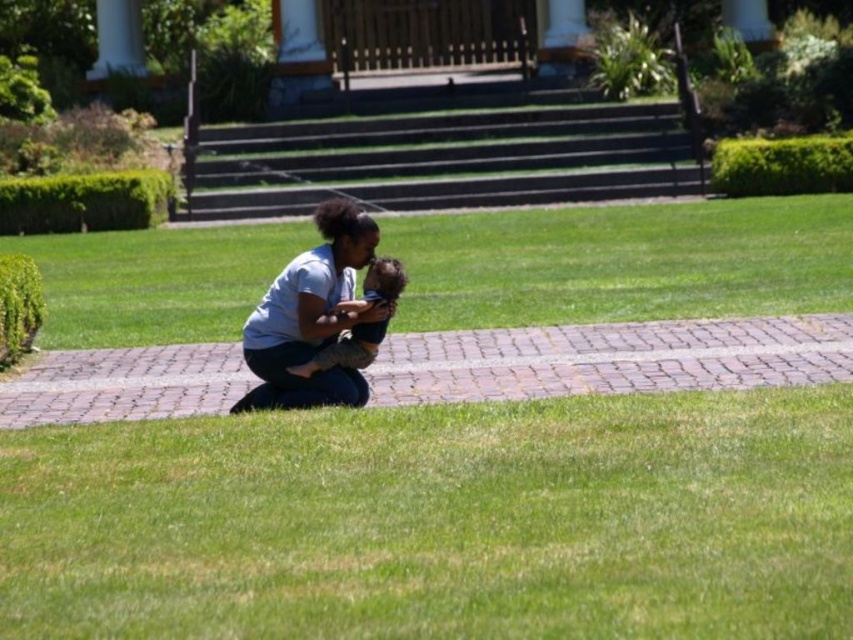
Question: Which object appears closest to the camera in this image?

Choices:
 (A) green grass at center
 (B) smooth skin child at center
 (C) light blue cotton shirt at center
 (D) green grass at lower center

Answer: (D)

Question: Does green grass at lower center have a lesser width compared to green grass at center?

Choices:
 (A) yes
 (B) no

Answer: (A)

Question: Which object appears closest to the camera in this image?

Choices:
 (A) light blue cotton shirt at center
 (B) green grass at center
 (C) smooth skin child at center

Answer: (A)

Question: Can you confirm if green grass at lower center is positioned to the right of light blue cotton shirt at center?

Choices:
 (A) yes
 (B) no

Answer: (A)

Question: Is the position of green grass at center less distant than that of smooth skin child at center?

Choices:
 (A) no
 (B) yes

Answer: (A)

Question: Which of the following is the closest to the observer?

Choices:
 (A) (636, 230)
 (B) (358, 323)
 (C) (329, 374)
 (D) (850, 609)

Answer: (D)